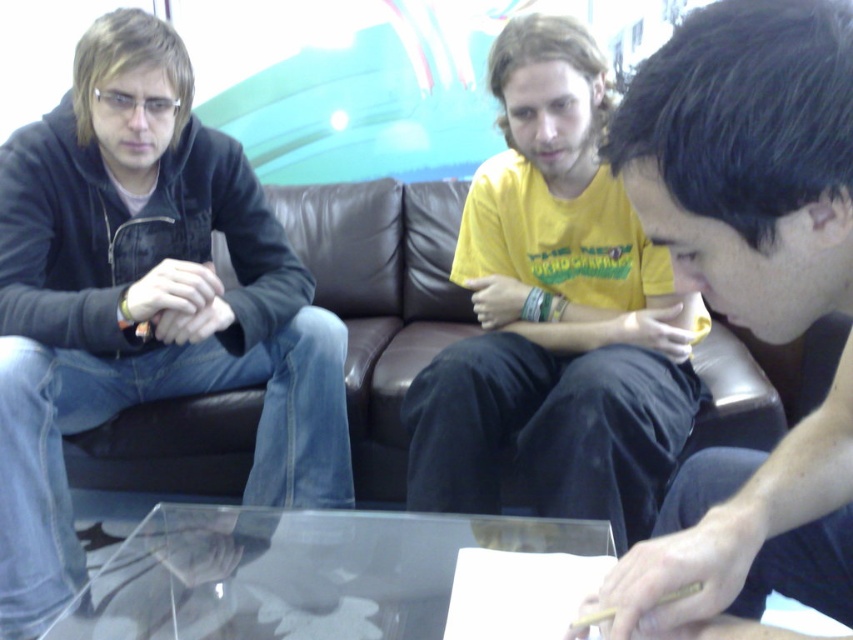
Can you confirm if yellow cotton shirt at center is positioned above brown leather couch at center?

Yes.

Which is above, yellow cotton shirt at center or brown leather couch at center?

yellow cotton shirt at center is higher up.

Who is more distant from viewer, (x=519, y=144) or (x=451, y=333)?

Point (x=451, y=333)

Identify the location of yellow cotton shirt at center. The width and height of the screenshot is (853, 640). (554, 314).

Is brown leather couch at center thinner than transparent glass table at center?

No.

Is brown leather couch at center shorter than transparent glass table at center?

Incorrect, brown leather couch at center's height does not fall short of transparent glass table at center's.

Does point (428, 266) lie in front of point (151, 513)?

No, it is not.

In order to click on brown leather couch at center in this screenshot , I will do `click(381, 300)`.

Measure the distance between matte black hoodie at left and camera.

matte black hoodie at left and camera are 4.36 feet apart.

Does matte black hoodie at left lie behind transparent glass table at center?

That is True.

Find the location of a particular element. The height and width of the screenshot is (640, 853). matte black hoodie at left is located at coordinates (143, 301).

Find the location of a particular element. Image resolution: width=853 pixels, height=640 pixels. matte black hoodie at left is located at coordinates (143, 301).